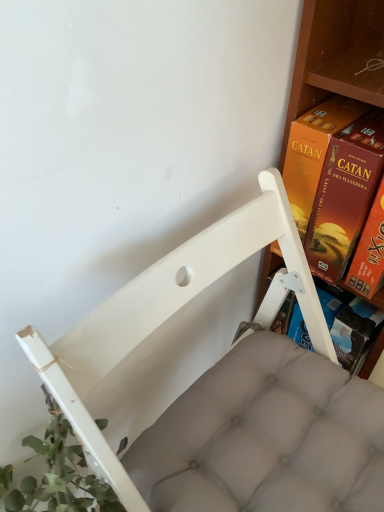
Question: Does white fabric chair at center contain orange cardboard game at right?

Choices:
 (A) yes
 (B) no

Answer: (B)

Question: Is white fabric chair at center to the right of orange cardboard game at right from the viewer's perspective?

Choices:
 (A) yes
 (B) no

Answer: (B)

Question: Does white fabric chair at center have a greater width compared to orange cardboard game at right?

Choices:
 (A) no
 (B) yes

Answer: (B)

Question: Considering the relative sizes of white fabric chair at center and orange cardboard game at right in the image provided, is white fabric chair at center taller than orange cardboard game at right?

Choices:
 (A) no
 (B) yes

Answer: (B)

Question: From the image's perspective, is white fabric chair at center above orange cardboard game at right?

Choices:
 (A) no
 (B) yes

Answer: (A)

Question: From the image's perspective, would you say white fabric chair at center is shown under orange cardboard game at right?

Choices:
 (A) yes
 (B) no

Answer: (A)

Question: From the image's perspective, is orange cardboard game at right above white fabric chair at center?

Choices:
 (A) no
 (B) yes

Answer: (B)

Question: Are orange cardboard game at right and white fabric chair at center beside each other?

Choices:
 (A) no
 (B) yes

Answer: (A)

Question: Is orange cardboard game at right further to the viewer compared to white fabric chair at center?

Choices:
 (A) no
 (B) yes

Answer: (B)

Question: Does orange cardboard game at right have a larger size compared to white fabric chair at center?

Choices:
 (A) yes
 (B) no

Answer: (B)

Question: Can you confirm if orange cardboard game at right is thinner than white fabric chair at center?

Choices:
 (A) yes
 (B) no

Answer: (A)

Question: Can you confirm if orange cardboard game at right is positioned to the left of white fabric chair at center?

Choices:
 (A) yes
 (B) no

Answer: (B)

Question: In terms of width, does orange cardboard game at right look wider or thinner when compared to white fabric chair at center?

Choices:
 (A) thin
 (B) wide

Answer: (A)